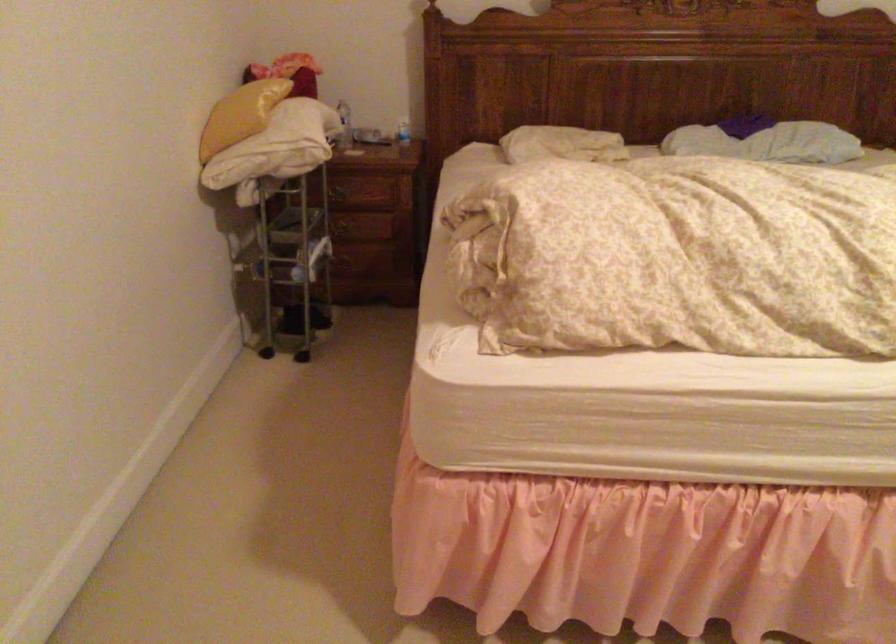
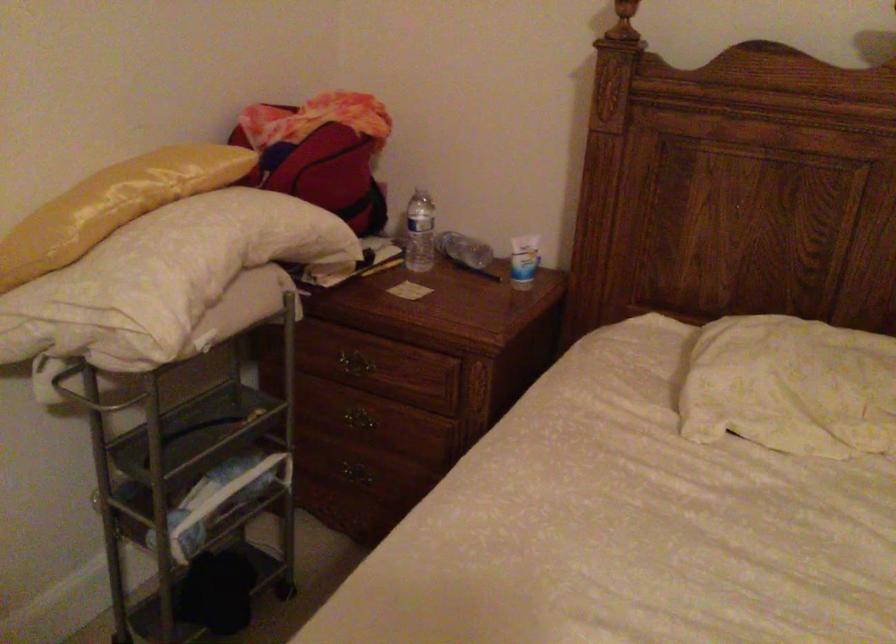
The point at (354, 120) is marked in the first image. Where is the corresponding point in the second image?

(419, 232)